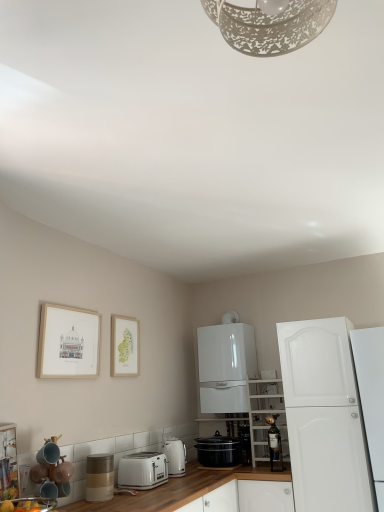
Describe the element at coordinates (99, 477) in the screenshot. I see `matte beige container at lower left, the third appliance when ordered from front to back` at that location.

Locate an element on the screen. matte white toaster at lower left, positioned as the 2th appliance in left-to-right order is located at coordinates (28, 504).

Image resolution: width=384 pixels, height=512 pixels. What do you see at coordinates (245, 444) in the screenshot? I see `black glossy slow cooker at center, arranged as the 1th appliance when viewed from the back` at bounding box center [245, 444].

Locate an element on the screen. The image size is (384, 512). watercolor paper picture frame at upper center, which is the second picture frame in left-to-right order is located at coordinates (125, 346).

Where is `white plastic toaster at lower center`? Image resolution: width=384 pixels, height=512 pixels. white plastic toaster at lower center is located at coordinates (143, 470).

Between metallic gold wine bottle at center, the second appliance when ordered from back to front, and white matte cabinet at right, the third cabinetry viewed from the left, which one is positioned behind?

metallic gold wine bottle at center, the second appliance when ordered from back to front, is behind.

Consider the image. From a real-world perspective, does metallic gold wine bottle at center, arranged as the fifth appliance when viewed from the left, sit lower than white matte cabinet at right, acting as the 1th cabinetry starting from the right?

Yes, from a real-world perspective, metallic gold wine bottle at center, arranged as the fifth appliance when viewed from the left, is below white matte cabinet at right, acting as the 1th cabinetry starting from the right.

Looking at this image, which of these two, metallic gold wine bottle at center, the 4th appliance positioned from the front, or white matte cabinet at right, acting as the 1th cabinetry starting from the right, is thinner?

With smaller width is metallic gold wine bottle at center, the 4th appliance positioned from the front.

In the scene shown: How much distance is there between metallic gold wine bottle at center, which is counted as the 1th appliance, starting from the right, and white matte cabinet at right, acting as the 1th cabinetry starting from the right?

The distance of metallic gold wine bottle at center, which is counted as the 1th appliance, starting from the right, from white matte cabinet at right, acting as the 1th cabinetry starting from the right, is 17.77 inches.

From a real-world perspective, is white matte shelving unit at center-right, which is counted as the 2th cabinetry, starting from the left, physically above white plastic toaster at lower center?

Yes, from a real-world perspective, white matte shelving unit at center-right, which is counted as the 2th cabinetry, starting from the left, is over white plastic toaster at lower center

Is white matte shelving unit at center-right, the 2th cabinetry viewed from the right, taller or shorter than white plastic toaster at lower center?

Clearly, white matte shelving unit at center-right, the 2th cabinetry viewed from the right, is taller compared to white plastic toaster at lower center.

How far apart are white matte shelving unit at center-right, the 2th cabinetry viewed from the right, and white plastic toaster at lower center?

white matte shelving unit at center-right, the 2th cabinetry viewed from the right, and white plastic toaster at lower center are 34.97 inches apart.

Are white matte shelving unit at center-right, the 2th cabinetry viewed from the right, and black glossy slow cooker at center, arranged as the 5th appliance when viewed from the front, far apart?

white matte shelving unit at center-right, the 2th cabinetry viewed from the right, is actually quite close to black glossy slow cooker at center, arranged as the 5th appliance when viewed from the front.

Considering the sizes of objects white matte shelving unit at center-right, which is counted as the 2th cabinetry, starting from the left, and black glossy slow cooker at center, positioned as the fourth appliance in left-to-right order, in the image provided, who is thinner, white matte shelving unit at center-right, which is counted as the 2th cabinetry, starting from the left, or black glossy slow cooker at center, positioned as the fourth appliance in left-to-right order,?

With smaller width is black glossy slow cooker at center, positioned as the fourth appliance in left-to-right order.

Considering the sizes of objects white matte shelving unit at center-right, the 2th cabinetry viewed from the right, and black glossy slow cooker at center, positioned as the second appliance in right-to-left order, in the image provided, who is taller, white matte shelving unit at center-right, the 2th cabinetry viewed from the right, or black glossy slow cooker at center, positioned as the second appliance in right-to-left order,?

white matte shelving unit at center-right, the 2th cabinetry viewed from the right, is taller.

From a real-world perspective, between white plastic toaster at lower center and matte white toaster at lower left, positioned as the 4th appliance in right-to-left order, who is vertically higher?

From a 3D spatial view, matte white toaster at lower left, positioned as the 4th appliance in right-to-left order, is above.

Is point (122, 470) closer or farther from the camera than point (49, 505)?

Point (122, 470) is farther from the camera than point (49, 505).

From the picture: Does white plastic toaster at lower center contain matte white toaster at lower left, the 1th appliance when ordered from front to back?

No, matte white toaster at lower left, the 1th appliance when ordered from front to back, is located outside of white plastic toaster at lower center.

From a real-world perspective, does white plastic toaster at lower center stand above matte white picture frame at upper left, the 2th picture frame when ordered from right to left?

No, from a real-world perspective, white plastic toaster at lower center is not over matte white picture frame at upper left, the 2th picture frame when ordered from right to left

Would you say white plastic toaster at lower center is a long distance from matte white picture frame at upper left, the 2th picture frame when ordered from right to left?

No, white plastic toaster at lower center is not far away from matte white picture frame at upper left, the 2th picture frame when ordered from right to left.

Does white plastic toaster at lower center come in front of matte white picture frame at upper left, which appears as the 1th picture frame when viewed from the front?

No, it is not.

From their relative heights in the image, would you say matte white toaster at lower left, the 1th appliance when ordered from front to back, is taller or shorter than white matte cabinet at right, acting as the 1th cabinetry starting from the right?

In the image, matte white toaster at lower left, the 1th appliance when ordered from front to back, appears to be shorter than white matte cabinet at right, acting as the 1th cabinetry starting from the right.

Is matte white toaster at lower left, the 1th appliance when ordered from front to back, thinner than white matte cabinet at right, the third cabinetry viewed from the left?

Yes, matte white toaster at lower left, the 1th appliance when ordered from front to back, is thinner than white matte cabinet at right, the third cabinetry viewed from the left.

Is matte white toaster at lower left, the fifth appliance in the back-to-front sequence, oriented towards white matte cabinet at right, acting as the 1th cabinetry starting from the right?

No.

Is matte white picture frame at upper left, the second picture frame in the back-to-front sequence, facing towards matte ceramic mugs at lower left, which is counted as the 1th appliance, starting from the left?

No, matte white picture frame at upper left, the second picture frame in the back-to-front sequence, is not turned towards matte ceramic mugs at lower left, which is counted as the 1th appliance, starting from the left.

From a real-world perspective, which object rests below the other?

From a 3D spatial view, matte ceramic mugs at lower left, which is counted as the 1th appliance, starting from the left, is below.

Are matte white picture frame at upper left, which appears as the 1th picture frame when viewed from the front, and matte ceramic mugs at lower left, the 2th appliance in the front-to-back sequence, far apart?

No, matte white picture frame at upper left, which appears as the 1th picture frame when viewed from the front, is in close proximity to matte ceramic mugs at lower left, the 2th appliance in the front-to-back sequence.

From the white matte cabinet at right, the third cabinetry viewed from the left, count the 1st appliance to the left and point to it. Please provide its 2D coordinates.

[(274, 444)]

You are a GUI agent. You are given a task and a screenshot of the screen. Output one action in this format:
    pyautogui.click(x=<x>, y=<y>)
    Task: Click on the toaster in front of the white matte shelving unit at center-right, which is counted as the 2th cabinetry, starting from the left
    The height and width of the screenshot is (512, 384).
    Given the screenshot: What is the action you would take?
    pyautogui.click(x=143, y=470)

When comparing their distances from white matte shelving unit at center-right, the 2th cabinetry viewed from the right, does black matte slow cooker at lower center, the second kitchen appliance when ordered from left to right, or white matte cabinet at right, the third cabinetry viewed from the left, seem further?

white matte cabinet at right, the third cabinetry viewed from the left, lies further to white matte shelving unit at center-right, the 2th cabinetry viewed from the right, than the other object.

Considering their positions, is watercolor paper picture frame at upper center, the 1th picture frame when ordered from right to left, positioned further to matte beige container at lower left, arranged as the 3th appliance when viewed from the left, than black glossy slow cooker at center, arranged as the 5th appliance when viewed from the front?

black glossy slow cooker at center, arranged as the 5th appliance when viewed from the front, is positioned further to the anchor matte beige container at lower left, arranged as the 3th appliance when viewed from the left.

Looking at the image, which one is located further to black matte slow cooker at lower center, which is the 1th kitchen appliance from right to left, matte white picture frame at upper left, which appears as the 1th picture frame when viewed from the front, or white matte shelving unit at center-right, which is counted as the 2th cabinetry, starting from the left?

The object further to black matte slow cooker at lower center, which is the 1th kitchen appliance from right to left, is matte white picture frame at upper left, which appears as the 1th picture frame when viewed from the front.

Looking at the image, which one is located closer to black matte slow cooker at lower center, which is the 1th kitchen appliance from right to left, matte beige container at lower left, arranged as the 3th appliance when viewed from the left, or white plastic toaster at lower center?

white plastic toaster at lower center lies closer to black matte slow cooker at lower center, which is the 1th kitchen appliance from right to left, than the other object.

From the image, which object appears to be nearer to white matte shelving unit at center-right, which is counted as the 2th cabinetry, starting from the left, matte white picture frame at upper left, the 2th picture frame when ordered from right to left, or white glossy electric kettle at lower center, the second kitchen appliance when ordered from right to left?

white glossy electric kettle at lower center, the second kitchen appliance when ordered from right to left, is positioned closer to the anchor white matte shelving unit at center-right, which is counted as the 2th cabinetry, starting from the left.

Which object lies nearer to the anchor point white matte shelving unit at center-right, the 2th cabinetry viewed from the right, white glossy electric kettle at lower center, the second kitchen appliance when ordered from right to left, or matte white picture frame at upper left, which appears as the 1th picture frame when viewed from the front?

white glossy electric kettle at lower center, the second kitchen appliance when ordered from right to left, is positioned closer to the anchor white matte shelving unit at center-right, the 2th cabinetry viewed from the right.

Looking at this image, estimate the real-world distances between objects in this image. Which object is further from white plastic toaster at lower center, matte beige container at lower left, which is the 3th appliance from right to left, or matte white picture frame at upper left, which appears as the 1th picture frame when viewed from the front?

The object further to white plastic toaster at lower center is matte white picture frame at upper left, which appears as the 1th picture frame when viewed from the front.

When comparing their distances from white glossy boiler at center, positioned as the 3th cabinetry in right-to-left order, does white matte shelving unit at center-right, the 2th cabinetry viewed from the right, or white glossy electric kettle at lower center, the second kitchen appliance when ordered from right to left, seem closer?

white matte shelving unit at center-right, the 2th cabinetry viewed from the right, is closer to white glossy boiler at center, positioned as the 3th cabinetry in right-to-left order.

Find the location of `appliance between white matte cabinet at right, the third cabinetry viewed from the left, and white glossy boiler at center, positioned as the 3th cabinetry in right-to-left order, along the z-axis`. appliance between white matte cabinet at right, the third cabinetry viewed from the left, and white glossy boiler at center, positioned as the 3th cabinetry in right-to-left order, along the z-axis is located at coordinates (274, 444).

Find the location of `picture frame located between matte white picture frame at upper left, which appears as the 1th picture frame when viewed from the front, and black glossy slow cooker at center, positioned as the fourth appliance in left-to-right order, in the left-right direction`. picture frame located between matte white picture frame at upper left, which appears as the 1th picture frame when viewed from the front, and black glossy slow cooker at center, positioned as the fourth appliance in left-to-right order, in the left-right direction is located at coordinates (125, 346).

Find the location of a particular element. The image size is (384, 512). picture frame between matte beige container at lower left, arranged as the 3th appliance when viewed from the left, and white glossy boiler at center, the 1th cabinetry from the left, from front to back is located at coordinates (125, 346).

At what (x,y) coordinates should I click in order to perform the action: click on kitchen appliance between matte ceramic mugs at lower left, the 5th appliance from the right, and black matte slow cooker at lower center, the second kitchen appliance when ordered from left to right, from front to back. Please return your answer as a coordinate pair (x, y). This screenshot has width=384, height=512. Looking at the image, I should click on (175, 456).